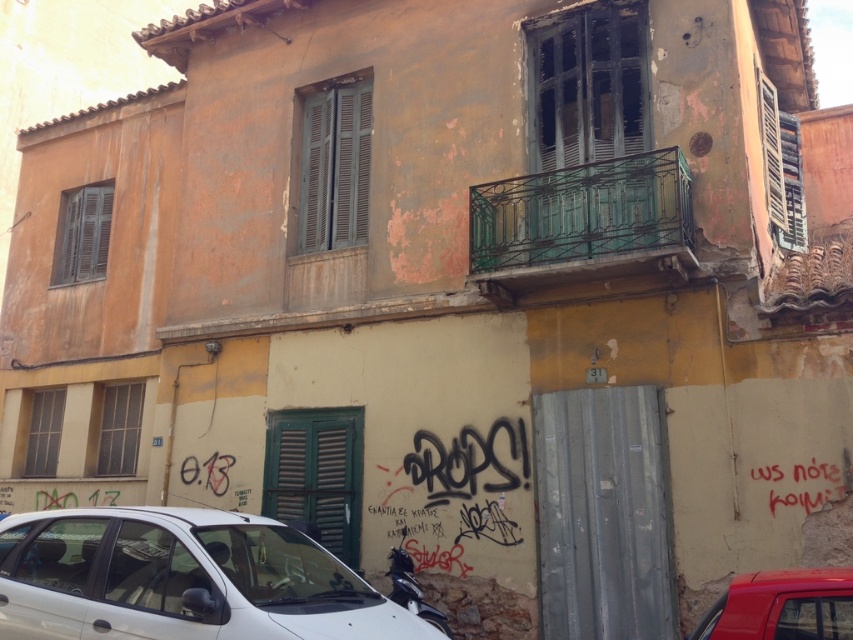
Which is in front, point (608, 35) or point (61, 269)?

Positioned in front is point (608, 35).

Locate an element on the screen. green painted wood at upper center is located at coordinates (590, 136).

I want to click on green painted wood at upper center, so click(x=590, y=136).

Can you confirm if green painted wood at upper center is positioned below shiny red car at lower right?

No, green painted wood at upper center is not below shiny red car at lower right.

Find the location of a particular element. The width and height of the screenshot is (853, 640). green painted wood at upper center is located at coordinates (590, 136).

I want to click on green painted wood at upper center, so click(590, 136).

Consider the image. Is white matte car at lower left to the right of matte gray shutters at center from the viewer's perspective?

No, white matte car at lower left is not to the right of matte gray shutters at center.

Between white matte car at lower left and matte gray shutters at center, which one has more height?

Standing taller between the two is matte gray shutters at center.

Which is in front, point (132, 604) or point (300, 244)?

Point (132, 604)

Find the location of a particular element. Image resolution: width=853 pixels, height=640 pixels. white matte car at lower left is located at coordinates (183, 579).